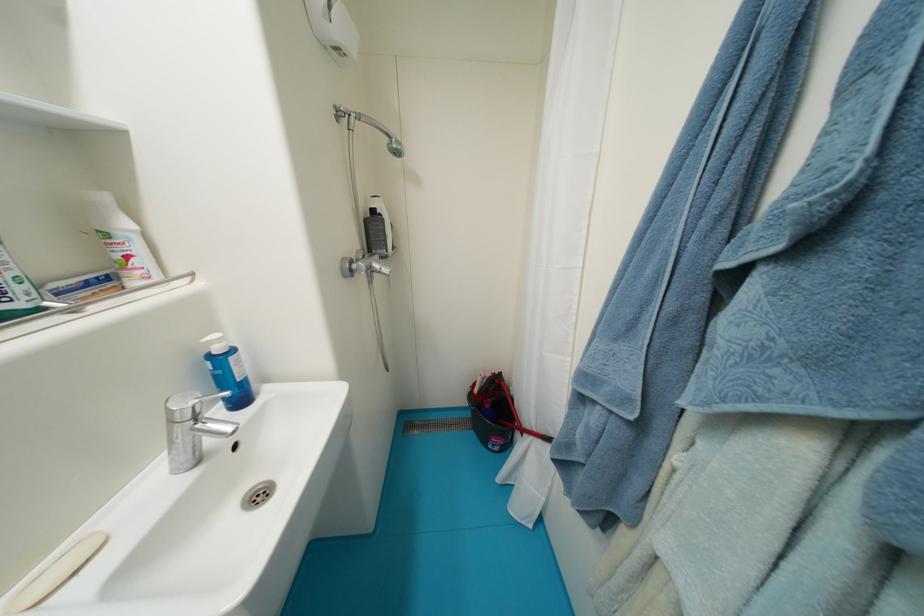
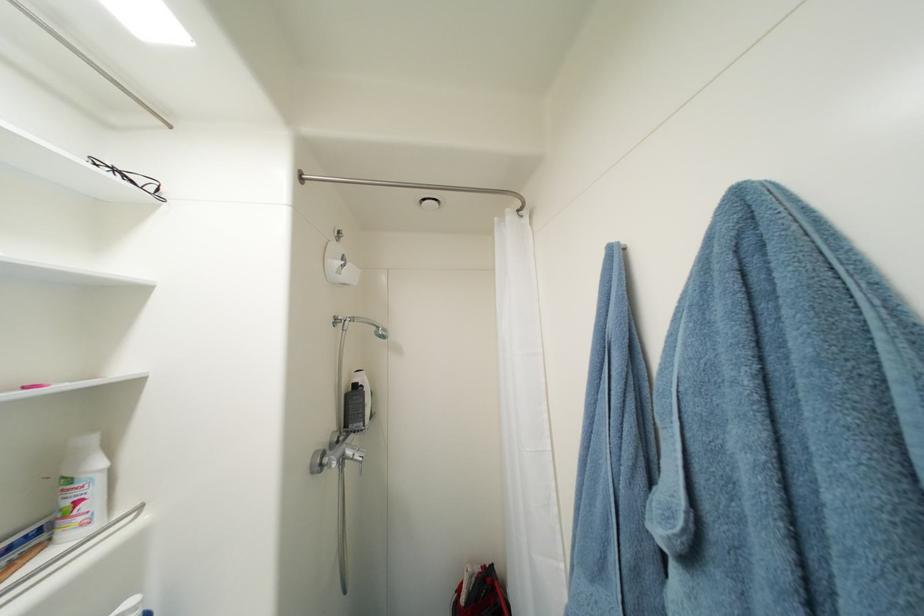
The point at [134,259] is marked in the first image. Where is the corresponding point in the second image?

(84, 504)